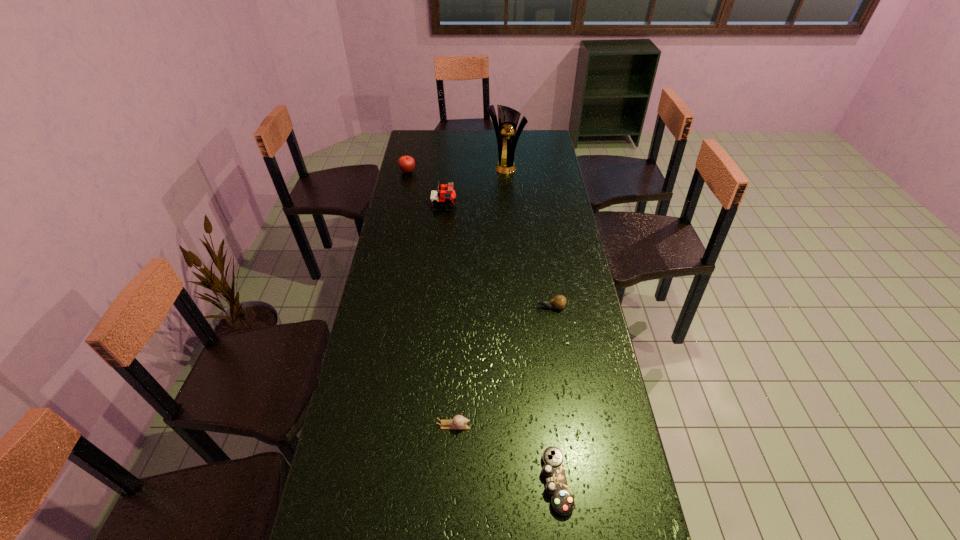
Locate an element on the screen. The width and height of the screenshot is (960, 540). vacant space that satisfies the following two spatial constraints: 1. at the front of the award, where the globe is visible; 2. on the left side of the shortest object is located at coordinates (530, 482).